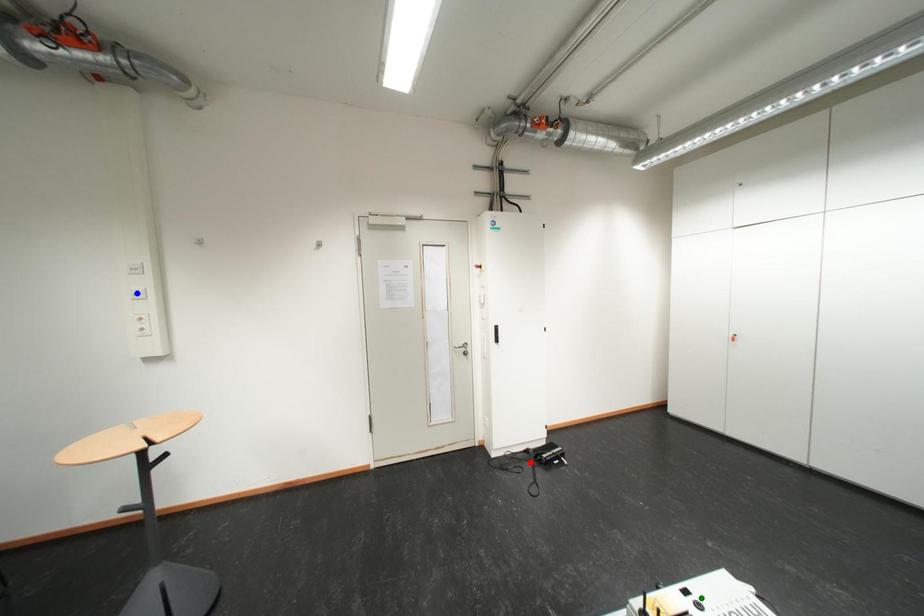
Order these from nearest to farthest:
A) red point
B) blue point
C) green point

red point < blue point < green point